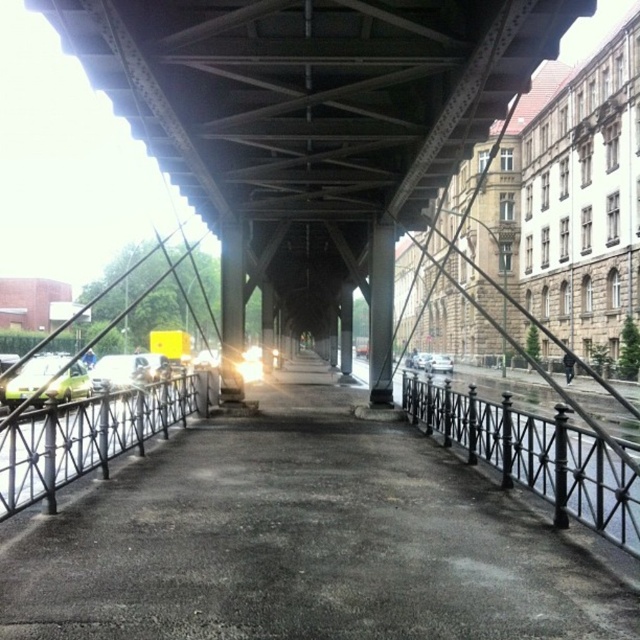
Question: Which of the following is the farthest from the observer?

Choices:
 (A) (38, 376)
 (B) (154, 374)
 (C) (157, 419)

Answer: (B)

Question: Where is metallic gray bridge at center located in relation to shiny silver car at center in the image?

Choices:
 (A) right
 (B) left

Answer: (A)

Question: Does shiny silver car at center have a greater width compared to silver metallic car at center?

Choices:
 (A) yes
 (B) no

Answer: (A)

Question: Among these objects, which one is nearest to the camera?

Choices:
 (A) shiny silver car at center
 (B) green matte car at left
 (C) metallic gray bridge at center

Answer: (C)

Question: Which object is positioned farthest from the metallic gray bridge at center?

Choices:
 (A) silver metallic car at center
 (B) green matte car at left

Answer: (A)

Question: In this image, where is shiny silver car at center located relative to silver metallic car at center?

Choices:
 (A) above
 (B) below

Answer: (A)